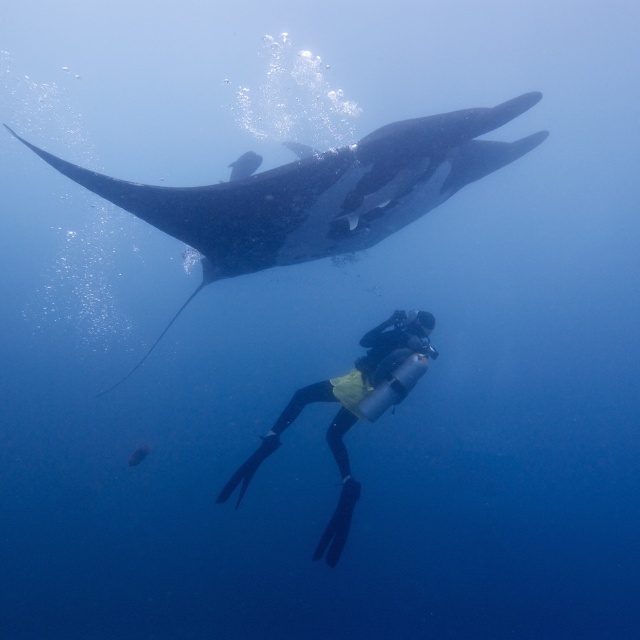
You are a marine biologist filming an underwater documentary. You need to position your camera to capture the dark gray matte stingray at upper center clearly. Given that your camera has a maximum focus range of 4 meters, will you be able to capture the stingray at its current distance?

The dark gray matte stingray at upper center is 4.59 meters from camera. Since the camera can only focus up to 4 meters, you will not be able to capture the stingray clearly at this distance.

Based on the photo, you are a marine biologist observing an underwater scene. You notice the dark gray matte stingray at upper center and the yellow neoprene suit at center. Which object is bigger in size?

The dark gray matte stingray at upper center has a larger size compared to the yellow neoprene suit at center, so the dark gray matte stingray at upper center is bigger in size.